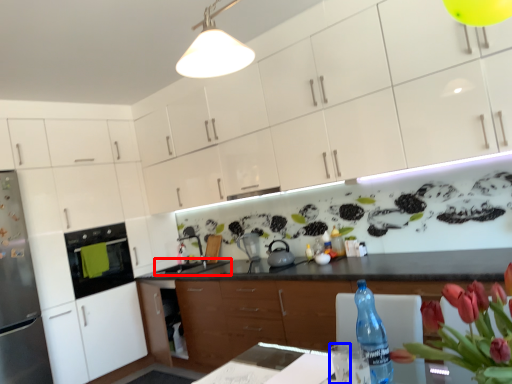
Question: Which point is closer to the camera, sink (highlighted by a red box) or water (highlighted by a blue box)?

Choices:
 (A) sink
 (B) water

Answer: (B)